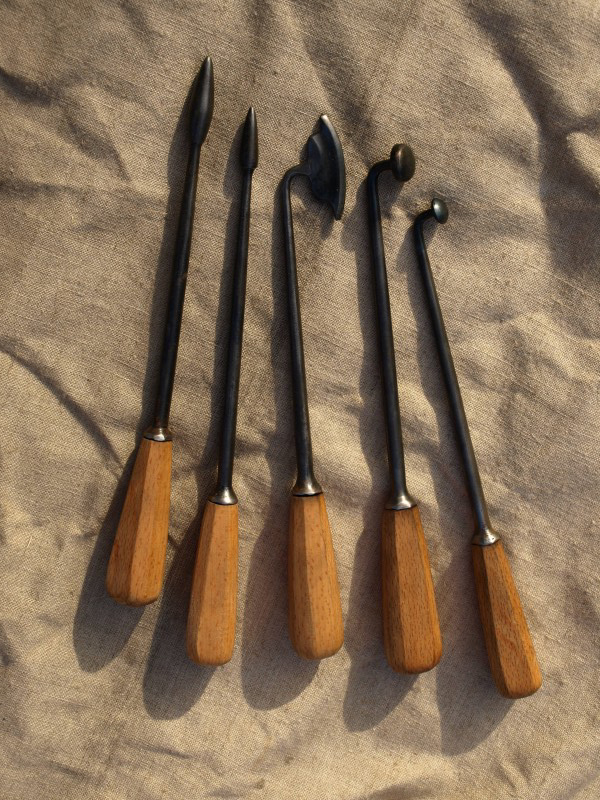
Find the location of a particular element. The image size is (600, 800). crinkles in sheet is located at coordinates (83, 132).